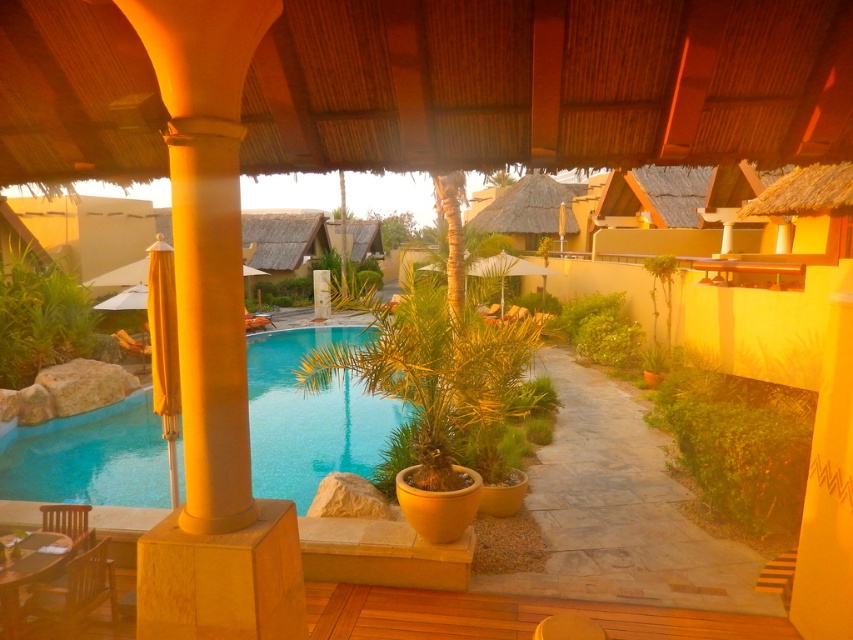
Question: Does green leafy plant at center appear on the right side of green leafy plant at left?

Choices:
 (A) no
 (B) yes

Answer: (B)

Question: Which object is positioned farthest from the green leafy plant at left?

Choices:
 (A) wooden lounge chair at lower left
 (B) blue glossy swimming pool at lower left
 (C) green leafy plant at center

Answer: (C)

Question: Does matte yellow column at left appear on the left side of wooden lounge chair at lower left?

Choices:
 (A) no
 (B) yes

Answer: (A)

Question: Is the position of green leafy plant at center less distant than that of wooden chair at lower left?

Choices:
 (A) yes
 (B) no

Answer: (B)

Question: Which object is the closest to the green leafy plant at center?

Choices:
 (A) matte yellow column at left
 (B) blue glossy swimming pool at lower left
 (C) green leafy plant at left
 (D) wooden chair at lower left

Answer: (D)

Question: Based on their relative distances, which object is farther from the matte yellow column at left?

Choices:
 (A) green leafy plant at left
 (B) wooden chair at lower left

Answer: (A)